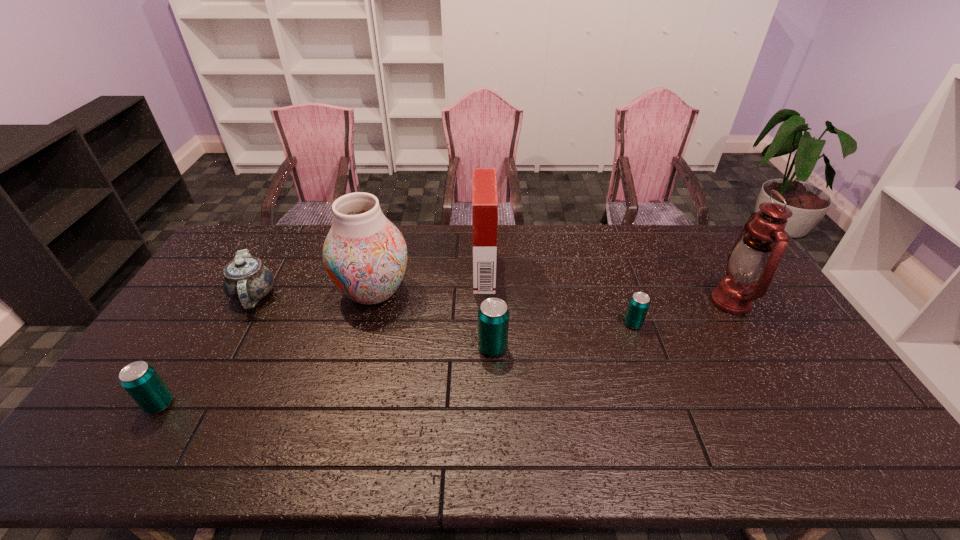
Where is `free space between the second farthest beer can and the vase`? The width and height of the screenshot is (960, 540). free space between the second farthest beer can and the vase is located at coordinates (433, 320).

Locate an element on the screen. vacant space in between the chinaware and the second shortest beer can is located at coordinates (206, 350).

Where is `free space between the vase and the cigarette_case`? The height and width of the screenshot is (540, 960). free space between the vase and the cigarette_case is located at coordinates (429, 282).

You are a GUI agent. You are given a task and a screenshot of the screen. Output one action in this format:
    pyautogui.click(x=<x>, y=<y>)
    Task: Click on the empty space that is in between the vase and the cigarette_case
    The width and height of the screenshot is (960, 540).
    Given the screenshot: What is the action you would take?
    pyautogui.click(x=429, y=282)

Locate an element on the screen. The image size is (960, 540). free space between the second shortest beer can and the cigarette_case is located at coordinates (322, 338).

The image size is (960, 540). Find the location of `free space between the second tallest beer can and the cigarette_case`. free space between the second tallest beer can and the cigarette_case is located at coordinates [322, 338].

The image size is (960, 540). I want to click on vacant area between the farthest beer can and the second farthest beer can, so click(563, 336).

Where is `free space between the chinaware and the vase`? This screenshot has width=960, height=540. free space between the chinaware and the vase is located at coordinates (314, 294).

Choose which object is the fourth nearest neighbor to the cigarette_case. Please provide its 2D coordinates. Your answer should be formatted as a tuple, i.e. [(x, y)], where the tuple contains the x and y coordinates of a point satisfying the conditions above.

[(246, 280)]

Find the location of a particular element. The height and width of the screenshot is (540, 960). object that ranks as the second closest to the second tallest beer can is located at coordinates (365, 255).